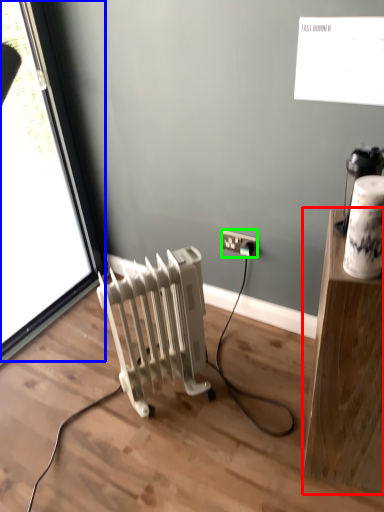
Question: Which object is positioned closest to furniture (highlighted by a red box)? Select from window (highlighted by a blue box) and power plugs and sockets (highlighted by a green box).

Choices:
 (A) window
 (B) power plugs and sockets

Answer: (B)